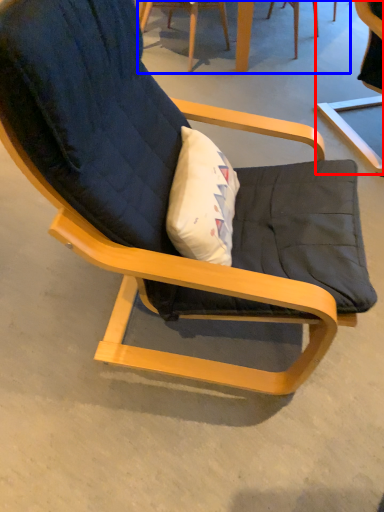
Question: Which of the following is the farthest to the observer, chair (highlighted by a red box) or table (highlighted by a blue box)?

Choices:
 (A) chair
 (B) table

Answer: (B)